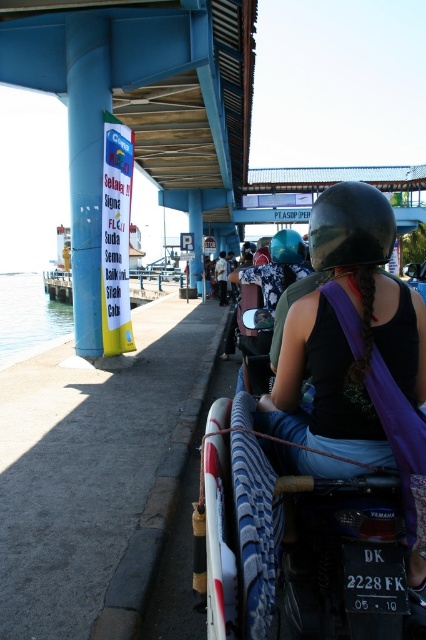
Is matte black helmet at center to the right of black glossy helmet at upper center from the viewer's perspective?

No, matte black helmet at center is not to the right of black glossy helmet at upper center.

Who is shorter, matte black helmet at center or black glossy helmet at upper center?

With less height is black glossy helmet at upper center.

At what (x,y) coordinates should I click in order to perform the action: click on matte black helmet at center. Please return your answer as a coordinate pair (x, y). The width and height of the screenshot is (426, 640). Looking at the image, I should click on (345, 333).

Who is taller, clear blue water at lower left or glossy black helmet at upper center?

Standing taller between the two is clear blue water at lower left.

Which is more to the left, clear blue water at lower left or glossy black helmet at upper center?

From the viewer's perspective, clear blue water at lower left appears more on the left side.

Image resolution: width=426 pixels, height=640 pixels. I want to click on clear blue water at lower left, so click(28, 316).

Looking at this image, between matte black helmet at center and clear blue water at lower left, which one has less height?

matte black helmet at center

Is point (325, 435) in front of point (28, 323)?

Yes, it is in front of point (28, 323).

The width and height of the screenshot is (426, 640). I want to click on matte black helmet at center, so click(x=345, y=333).